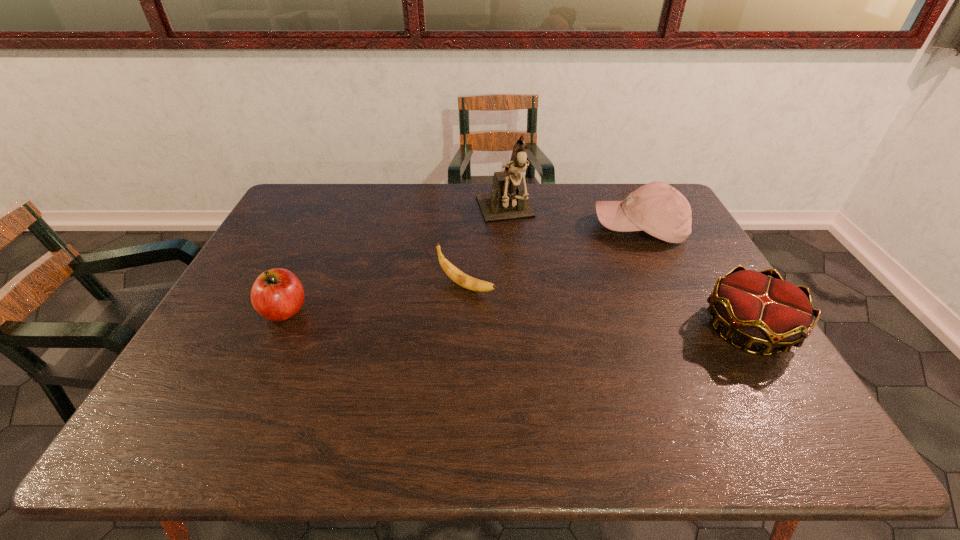
Where is `vacant space situated 0.320m on the front-facing side of the figurine`? The width and height of the screenshot is (960, 540). vacant space situated 0.320m on the front-facing side of the figurine is located at coordinates (543, 308).

Find the location of a particular element. This screenshot has width=960, height=540. vacant space located on the front-facing side of the figurine is located at coordinates (550, 325).

Identify the location of vacant point located on the front-facing side of the figurine. The height and width of the screenshot is (540, 960). (550, 325).

The width and height of the screenshot is (960, 540). Identify the location of blank area located 0.090m on the front-facing side of the baseball cap. (594, 255).

At what (x,y) coordinates should I click in order to perform the action: click on vacant space located on the front-facing side of the baseball cap. Please return your answer as a coordinate pair (x, y). The image size is (960, 540). Looking at the image, I should click on (531, 302).

Identify the location of vacant space located 0.170m on the front-facing side of the baseball cap. This screenshot has width=960, height=540. (579, 267).

Where is `figurine present at the far edge`? figurine present at the far edge is located at coordinates (507, 201).

The height and width of the screenshot is (540, 960). In order to click on baseball cap situated at the far edge in this screenshot , I will do `click(657, 208)`.

The width and height of the screenshot is (960, 540). In order to click on object present at the left edge in this screenshot , I will do `click(277, 294)`.

Locate an element on the screen. The image size is (960, 540). crown positioned at the right edge is located at coordinates (770, 312).